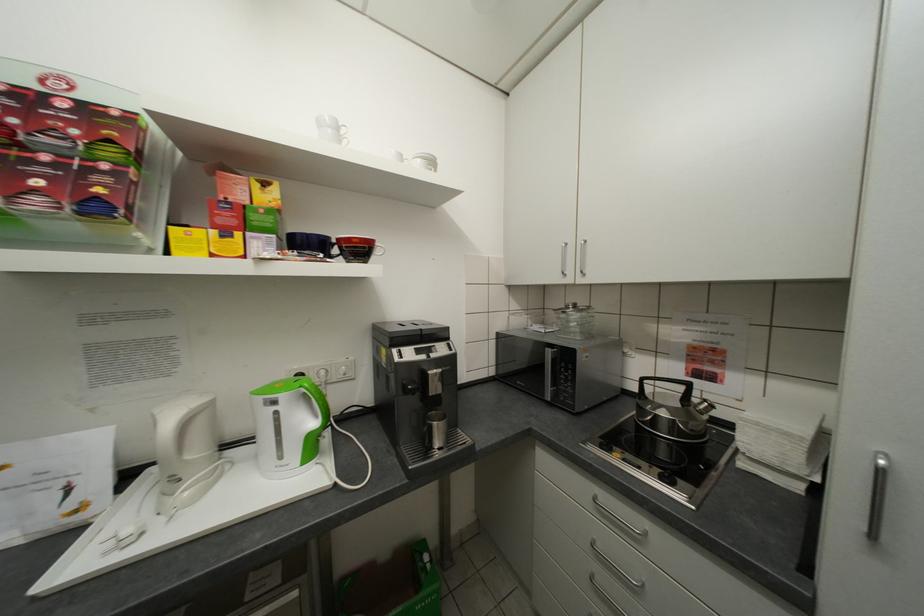
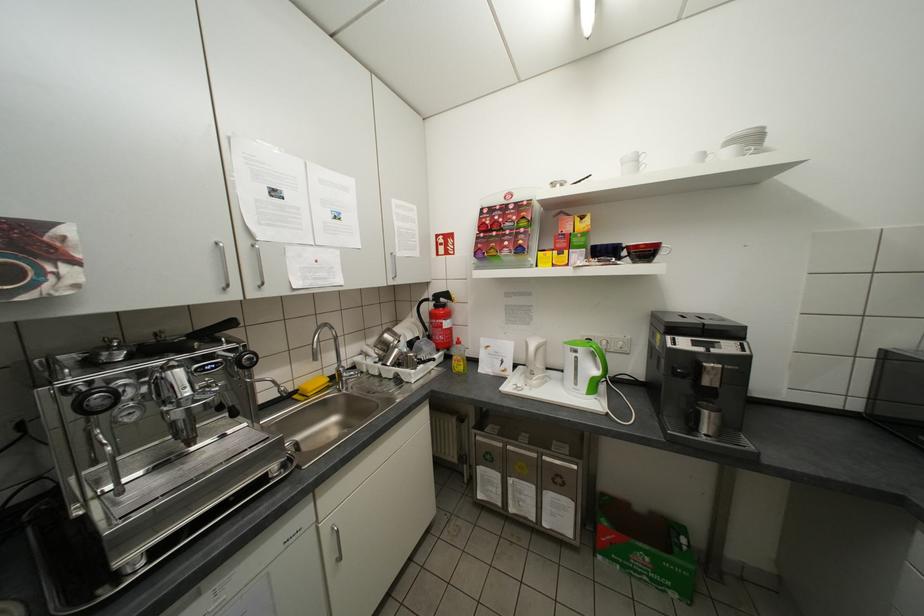
Where in the second image is the point corresponding to pixel 430 330 from the first image?

(712, 323)